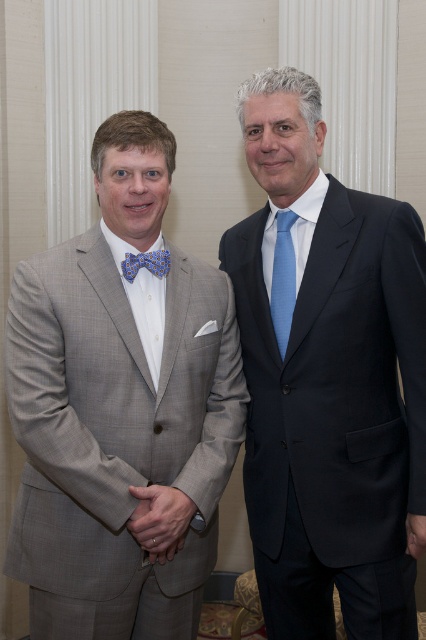
You are a photographer setting up for a portrait session. You need to ensure that all clothing items on the left side of the image are visible in the frame. Given that the light gray textured suit at left and the blue printed fabric bow tie at left are both on the left side, which one might require more space in the frame to be fully captured?

The light gray textured suit at left is larger in size than the blue printed fabric bow tie at left, so it would require more space in the frame to be fully captured.

You are a photographer setting up for a portrait. You need to ensure that the light gray textured suit at left and the blue printed fabric bow tie at left are both in focus. Since the bow tie is closer to the camera, will the suit still be in focus if you focus on the bow tie?

Yes, the light gray textured suit at left will still be in focus because it is positioned to the left of the blue printed fabric bow tie at left, which is closer to the camera. However, depth of field considerations depend on factors like aperture and lens used, but spatially they are aligned along the same plane horizontally.

You are a photographer setting up for a portrait session. You have two subjects in front of you, wearing a satin black suit at right and a light blue textured tie at center. You want to ensure that both subjects are clearly visible in the photo. Based on their positions, which subject should you focus on first to ensure proper depth of field?

The satin black suit at right is in front of the light blue textured tie at center, so you should focus on the satin black suit at right first to ensure both are in focus.